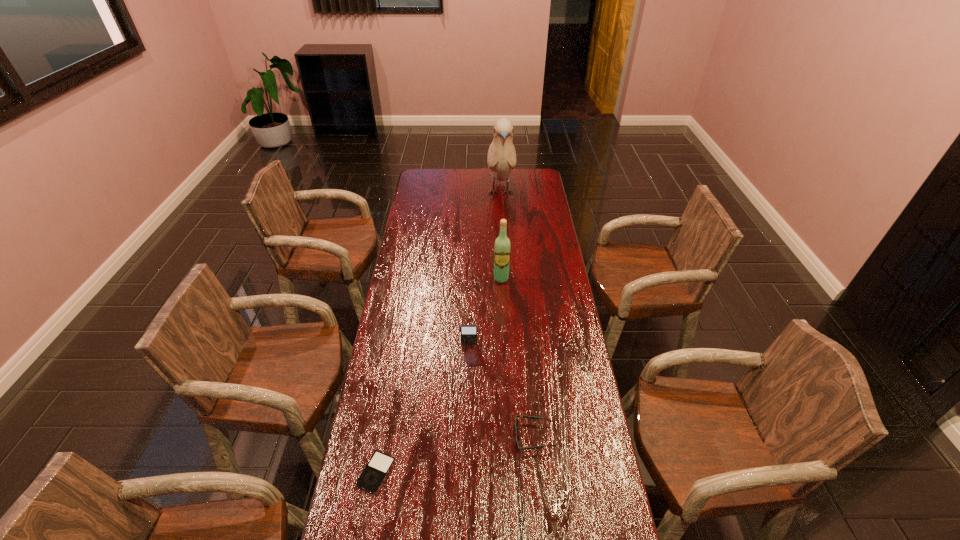
This screenshot has width=960, height=540. In order to click on free space located on the front-facing side of the wine bottle in this screenshot , I will do `click(505, 353)`.

Identify the location of vacant region located on the front-facing side of the second object from left to right. (468, 391).

The image size is (960, 540). Identify the location of vacant area situated on the front-facing side of the fourth tallest object. (389, 436).

Where is `free point located 0.380m on the front-facing side of the fourth tallest object`? free point located 0.380m on the front-facing side of the fourth tallest object is located at coordinates pos(392,436).

Where is `free space located on the front-facing side of the fourth tallest object`? free space located on the front-facing side of the fourth tallest object is located at coordinates (389, 436).

Where is `vacant space situated 0.340m on the back of the shorter iPod`? vacant space situated 0.340m on the back of the shorter iPod is located at coordinates (396, 361).

The width and height of the screenshot is (960, 540). Identify the location of object that is positioned at the far edge. (501, 159).

I want to click on object that is at the left edge, so click(x=375, y=472).

Locate an element on the screen. This screenshot has height=540, width=960. object at the right edge is located at coordinates (524, 416).

Image resolution: width=960 pixels, height=540 pixels. In the image, there is a desktop. Find the location of `free region at the far edge`. free region at the far edge is located at coordinates (472, 174).